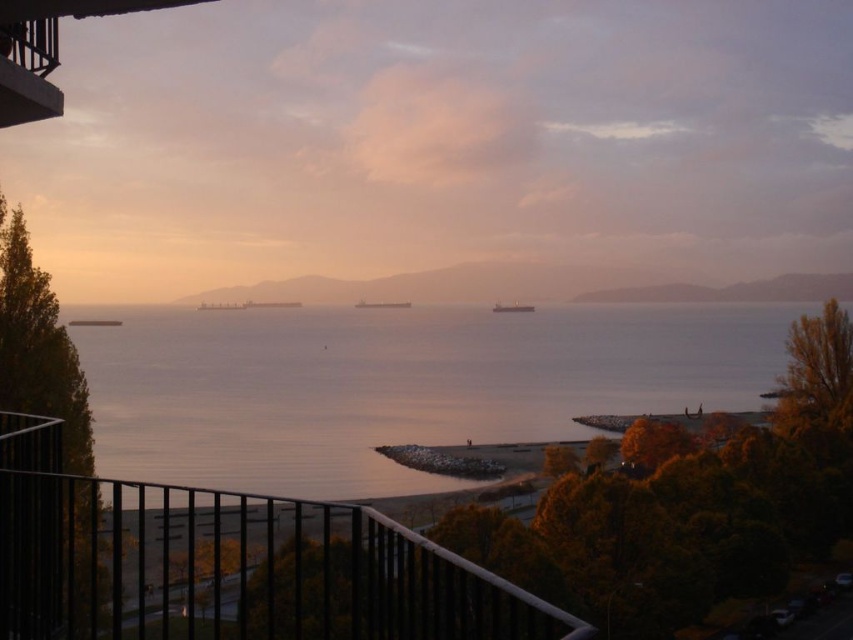
Question: Does matte gray ship at center appear under metallic gray ship at center?

Choices:
 (A) no
 (B) yes

Answer: (A)

Question: Which object is closer to the camera taking this photo?

Choices:
 (A) metallic gray ship at center
 (B) black metal railing at lower left
 (C) matte gray ship at center

Answer: (B)

Question: Estimate the real-world distances between objects in this image. Which object is farther from the metallic gray ship at center?

Choices:
 (A) matte gray ship at center
 (B) black metal railing at lower left
 (C) black metal balcony at upper left

Answer: (C)

Question: Which of these objects is positioned farthest from the matte gray ship at center?

Choices:
 (A) metallic gray ship at center
 (B) black metal railing at lower left
 (C) black metal balcony at upper left

Answer: (C)

Question: Can you confirm if black metal balcony at upper left is positioned below matte gray ship at center?

Choices:
 (A) no
 (B) yes

Answer: (B)

Question: Where is black metal balcony at upper left located in relation to metallic gray ship at center in the image?

Choices:
 (A) left
 (B) right

Answer: (A)